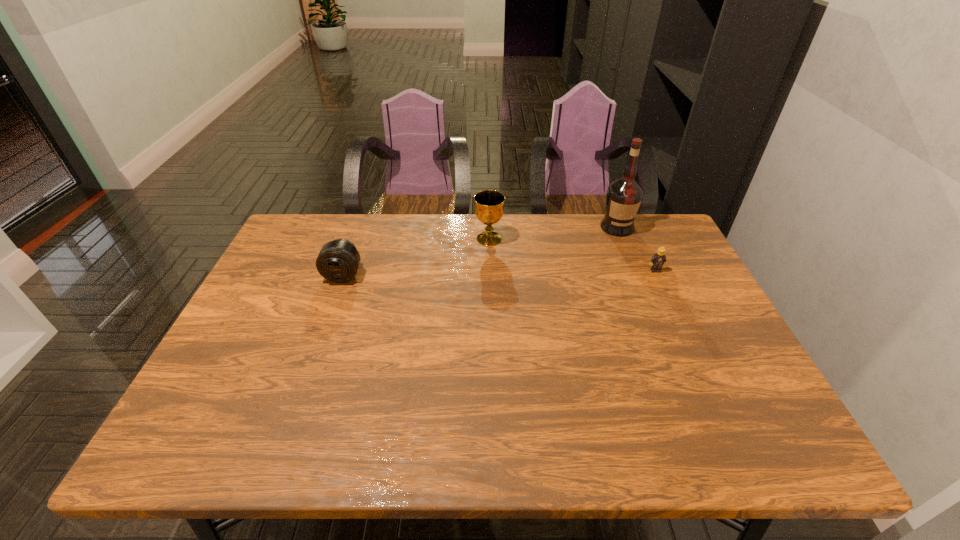
Find the location of a particular element. liquor at the far edge is located at coordinates (624, 196).

Identify the location of chalice positioned at the far edge. The image size is (960, 540). (489, 210).

At what (x,y) coordinates should I click in order to perform the action: click on liquor positioned at the right edge. Please return your answer as a coordinate pair (x, y). The image size is (960, 540). Looking at the image, I should click on (624, 196).

At what (x,y) coordinates should I click in order to perform the action: click on Lego situated at the right edge. Please return your answer as a coordinate pair (x, y). Looking at the image, I should click on (657, 260).

This screenshot has width=960, height=540. I want to click on object that is at the far right corner, so click(624, 196).

Image resolution: width=960 pixels, height=540 pixels. In order to click on vacant region at the far edge of the desktop in this screenshot , I will do `click(520, 242)`.

At what (x,y) coordinates should I click in order to perform the action: click on free space at the near edge. Please return your answer as a coordinate pair (x, y). This screenshot has height=540, width=960. Looking at the image, I should click on (359, 436).

Find the location of a particular element. The image size is (960, 540). vacant space at the left edge of the desktop is located at coordinates (258, 332).

This screenshot has width=960, height=540. Find the location of `free space at the right edge`. free space at the right edge is located at coordinates (652, 289).

Find the location of `blank space at the near left corner`. blank space at the near left corner is located at coordinates (181, 423).